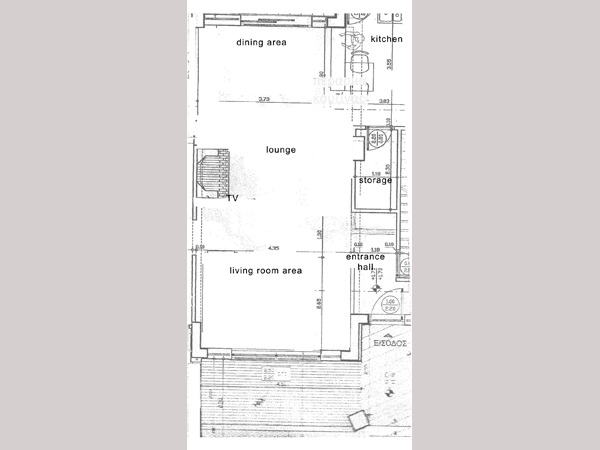
Locate an element on the screen. The width and height of the screenshot is (600, 450). entrance is located at coordinates (362, 257).